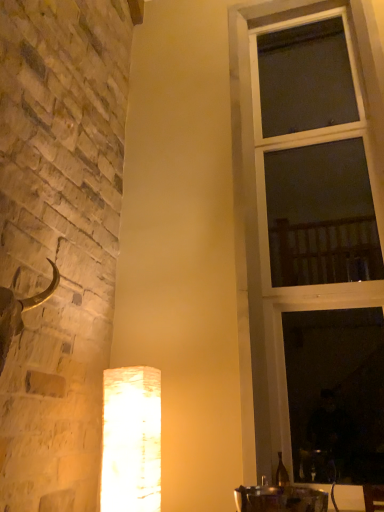
Question: In terms of height, does white textured lamp at lower center look taller or shorter compared to clear glass window at right?

Choices:
 (A) short
 (B) tall

Answer: (A)

Question: Which is correct: white textured lamp at lower center is inside clear glass window at right, or outside of it?

Choices:
 (A) outside
 (B) inside

Answer: (A)

Question: In the image, is white textured lamp at lower center positioned in front of or behind clear glass window at right?

Choices:
 (A) behind
 (B) front

Answer: (B)

Question: In terms of width, does clear glass window at right look wider or thinner when compared to white textured lamp at lower center?

Choices:
 (A) wide
 (B) thin

Answer: (B)

Question: Considering the relative positions of clear glass window at right and white textured lamp at lower center in the image provided, is clear glass window at right to the left or to the right of white textured lamp at lower center?

Choices:
 (A) left
 (B) right

Answer: (B)

Question: In the image, is clear glass window at right positioned in front of or behind white textured lamp at lower center?

Choices:
 (A) front
 (B) behind

Answer: (B)

Question: Considering the positions of clear glass window at right and white textured lamp at lower center in the image, is clear glass window at right taller or shorter than white textured lamp at lower center?

Choices:
 (A) short
 (B) tall

Answer: (B)